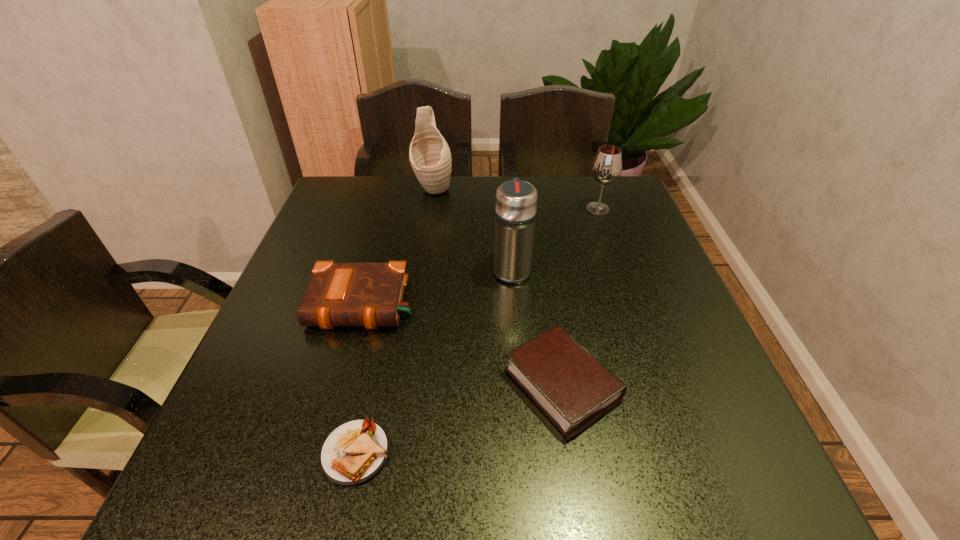
Where is `vacant space that's between the farthest object and the taller Bible`? This screenshot has width=960, height=540. vacant space that's between the farthest object and the taller Bible is located at coordinates (398, 246).

Find the location of `free space between the fourth tallest object and the shortest object`. free space between the fourth tallest object and the shortest object is located at coordinates coord(359,379).

At what (x,y) coordinates should I click in order to perform the action: click on free space between the sandwich and the thermos bottle. Please return your answer as a coordinate pair (x, y). The width and height of the screenshot is (960, 540). Looking at the image, I should click on (434, 361).

Identify the location of free space between the thermos bottle and the shortest object. coord(434,361).

Locate an element on the screen. free point between the farthest object and the farther Bible is located at coordinates (398, 246).

Where is `free point between the farther Bible and the nearer Bible`? This screenshot has width=960, height=540. free point between the farther Bible and the nearer Bible is located at coordinates [x=463, y=345].

Identify which object is the fifth nearest to the thermos bottle. Please provide its 2D coordinates. Your answer should be formatted as a tuple, i.e. [(x, y)], where the tuple contains the x and y coordinates of a point satisfying the conditions above.

[(355, 451)]

This screenshot has width=960, height=540. What are the coordinates of `the second closest object to the shortest object` in the screenshot? It's located at (339, 294).

Locate an element on the screen. vacant space that satisfies the following two spatial constraints: 1. at the spout of the pitcher; 2. on the left side of the second farthest object is located at coordinates (430, 208).

Where is `vacant space that satisfies the following two spatial constraints: 1. on the spine side of the shortest object; 2. on the left side of the taller Bible`? vacant space that satisfies the following two spatial constraints: 1. on the spine side of the shortest object; 2. on the left side of the taller Bible is located at coordinates (323, 453).